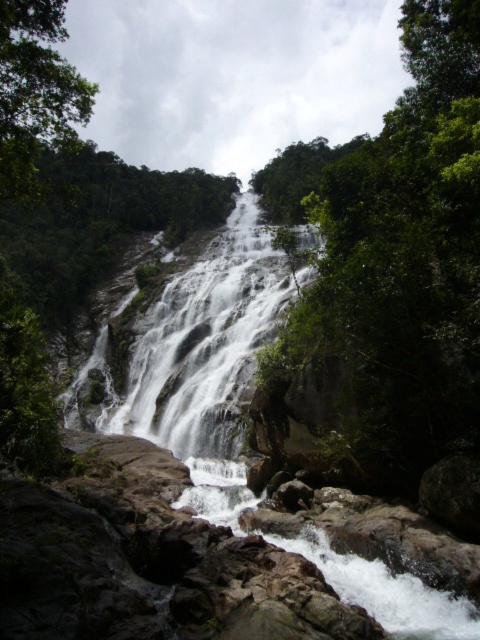
You are a hiker standing at the base of the white textured waterfall at center and want to take a photo of the green leafy tree at upper left. Since the waterfall is in front of you, will the tree be visible in your photo?

The green leafy tree at upper left is behind the white textured waterfall at center, so it will not be visible in the photo taken from the waterfall base.

You are a photographer standing at the edge of the river below the waterfall. You want to capture the white frothy water at center in your shot. Based on its coordinates, where should you aim your camera to ensure it is centered in your viewfinder?

The white frothy water at center is located at coordinates point (199, 362), so you should aim your camera at that point to center it in your viewfinder.